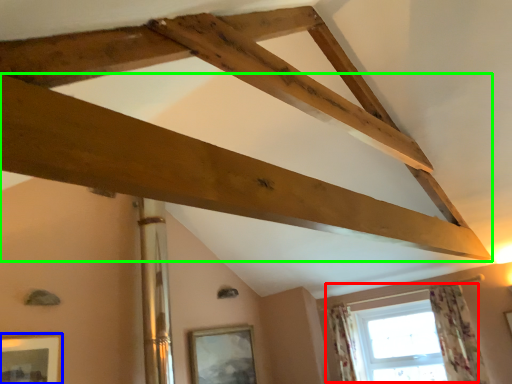
Question: Based on their relative distances, which object is nearer to window (highlighted by a red box)? Choose from picture frame (highlighted by a blue box) and plank (highlighted by a green box).

Choices:
 (A) picture frame
 (B) plank

Answer: (B)